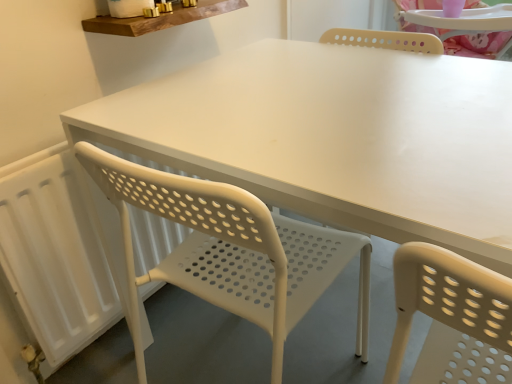
Question: In terms of height, does wooden shelf at upper center look taller or shorter compared to white perforated plastic chair at center?

Choices:
 (A) short
 (B) tall

Answer: (A)

Question: Looking at their shapes, would you say wooden shelf at upper center is wider or thinner than white perforated plastic chair at center?

Choices:
 (A) thin
 (B) wide

Answer: (A)

Question: Considering the real-world distances, which object is farthest from the white matte radiator at left?

Choices:
 (A) wooden shelf at upper center
 (B) white perforated plastic chair at center

Answer: (A)

Question: Which object is the closest to the white matte radiator at left?

Choices:
 (A) wooden shelf at upper center
 (B) white perforated plastic chair at center

Answer: (B)